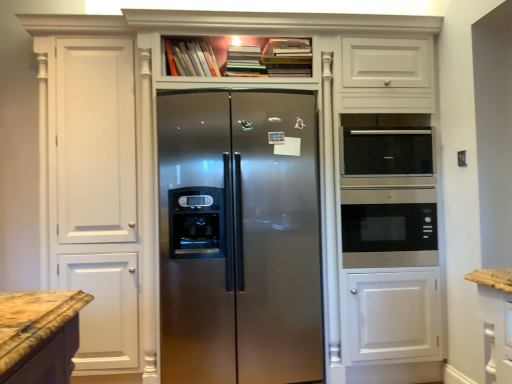
Question: Should I look upward or downward to see hardcover books at upper center, which ranks as the first book in right-to-left order?

Choices:
 (A) up
 (B) down

Answer: (A)

Question: Is hardcover book at upper center, which is counted as the 3th book, starting from the right, to the left of stainless steel refrigerator at center from the viewer's perspective?

Choices:
 (A) yes
 (B) no

Answer: (A)

Question: From the image's perspective, is hardcover book at upper center, acting as the first book starting from the left, under stainless steel refrigerator at center?

Choices:
 (A) yes
 (B) no

Answer: (B)

Question: Does hardcover book at upper center, which is counted as the 3th book, starting from the right, appear on the right side of stainless steel refrigerator at center?

Choices:
 (A) yes
 (B) no

Answer: (B)

Question: Considering the relative sizes of hardcover book at upper center, which is counted as the 3th book, starting from the right, and stainless steel refrigerator at center in the image provided, is hardcover book at upper center, which is counted as the 3th book, starting from the right, shorter than stainless steel refrigerator at center?

Choices:
 (A) no
 (B) yes

Answer: (B)

Question: Can you confirm if hardcover book at upper center, acting as the first book starting from the left, is taller than stainless steel refrigerator at center?

Choices:
 (A) yes
 (B) no

Answer: (B)

Question: Is hardcover book at upper center, which is counted as the 3th book, starting from the right, located outside stainless steel refrigerator at center?

Choices:
 (A) no
 (B) yes

Answer: (B)

Question: Is hardcover book at upper center, acting as the first book starting from the left, wider than hardcover books at upper center, which ranks as the first book in right-to-left order?

Choices:
 (A) no
 (B) yes

Answer: (A)

Question: Can you confirm if hardcover book at upper center, acting as the first book starting from the left, is shorter than hardcover books at upper center, which ranks as the first book in right-to-left order?

Choices:
 (A) no
 (B) yes

Answer: (B)

Question: Is hardcover book at upper center, acting as the first book starting from the left, to the right of hardcover books at upper center, the 3th book positioned from the left, from the viewer's perspective?

Choices:
 (A) no
 (B) yes

Answer: (A)

Question: Is hardcover book at upper center, acting as the first book starting from the left, smaller than hardcover books at upper center, which ranks as the first book in right-to-left order?

Choices:
 (A) yes
 (B) no

Answer: (A)

Question: Is hardcover book at upper center, which is counted as the 3th book, starting from the right, with hardcover books at upper center, the 3th book positioned from the left?

Choices:
 (A) yes
 (B) no

Answer: (B)

Question: Is hardcover book at upper center, acting as the first book starting from the left, not near hardcover books at upper center, the 3th book positioned from the left?

Choices:
 (A) no
 (B) yes

Answer: (A)

Question: Can you confirm if hardcover book at upper center, which is counted as the 3th book, starting from the right, is bigger than black glass microwave at right?

Choices:
 (A) yes
 (B) no

Answer: (B)